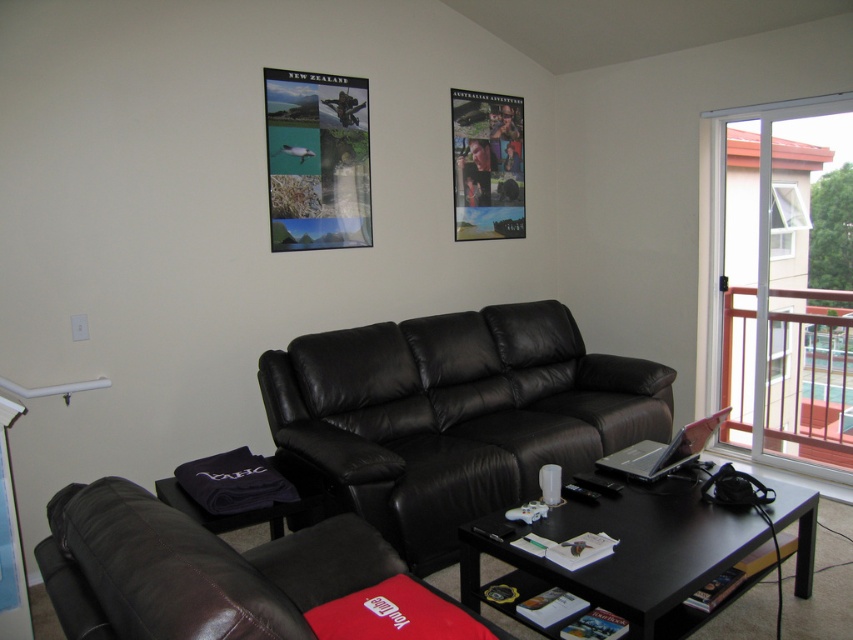
Between transparent glass door at right and black leather couch at lower left, which one is positioned lower?

black leather couch at lower left is lower down.

Measure the distance between transparent glass door at right and black leather couch at lower left.

transparent glass door at right is 11.75 feet away from black leather couch at lower left.

Is point (755, 113) farther from camera compared to point (165, 632)?

That is True.

The width and height of the screenshot is (853, 640). I want to click on transparent glass door at right, so click(779, 288).

Can you confirm if black glossy table at center is wider than white plastic railing at upper right?

Yes.

This screenshot has width=853, height=640. Describe the element at coordinates (628, 554) in the screenshot. I see `black glossy table at center` at that location.

Find the location of a particular element. black glossy table at center is located at coordinates (628, 554).

Which is above, black leather couch at center or metallic poster at upper center?

metallic poster at upper center is higher up.

The width and height of the screenshot is (853, 640). Identify the location of black leather couch at center. (450, 417).

Who is more forward, (347,508) or (270,168)?

Point (347,508) is more forward.

Image resolution: width=853 pixels, height=640 pixels. Identify the location of black leather couch at center. (450, 417).